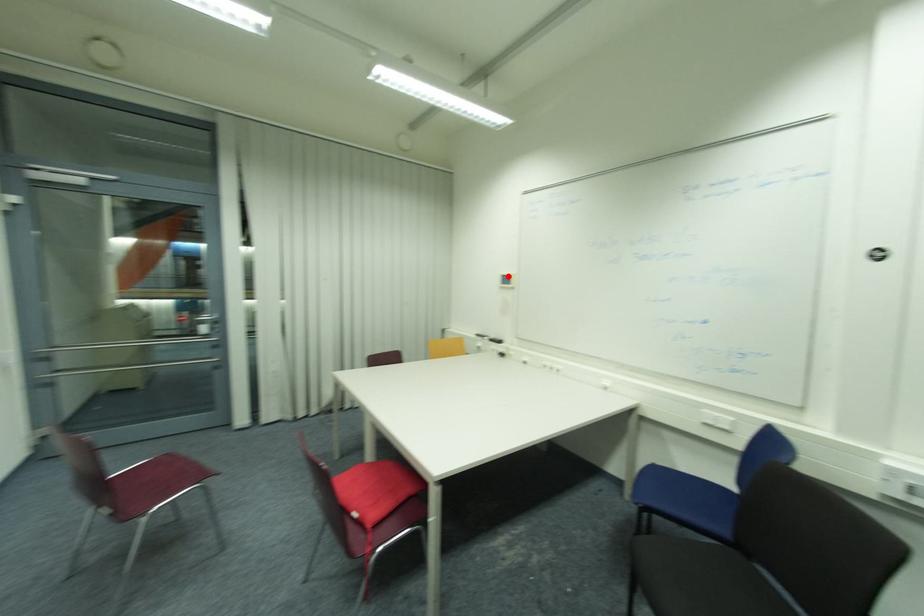
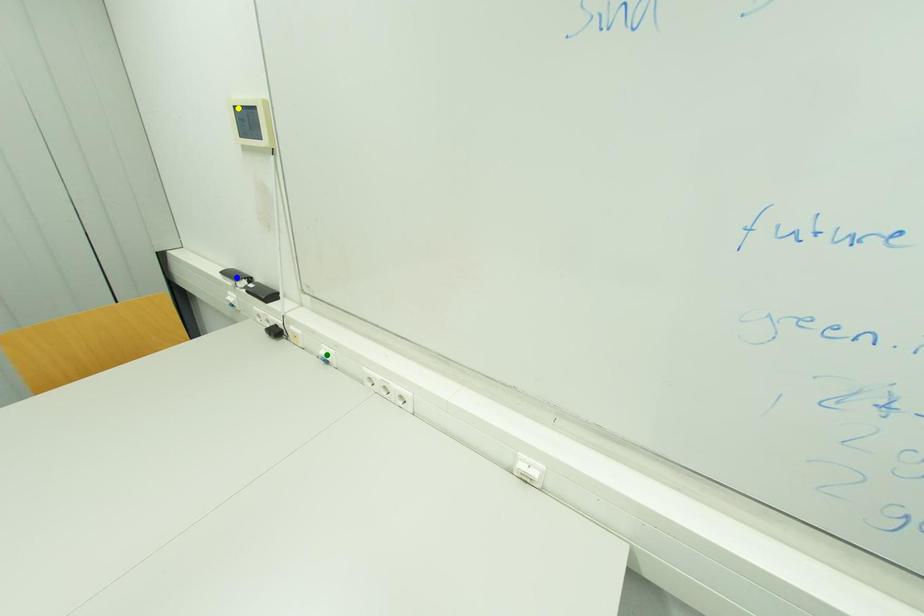
Question: I am providing you with two images of the same scene from different viewpoints. A red point is marked on the first image. You are given multiple points on the second image. Which spot in image 2 lines up with the point in image 1?

Choices:
 (A) blue point
 (B) green point
 (C) yellow point

Answer: (C)